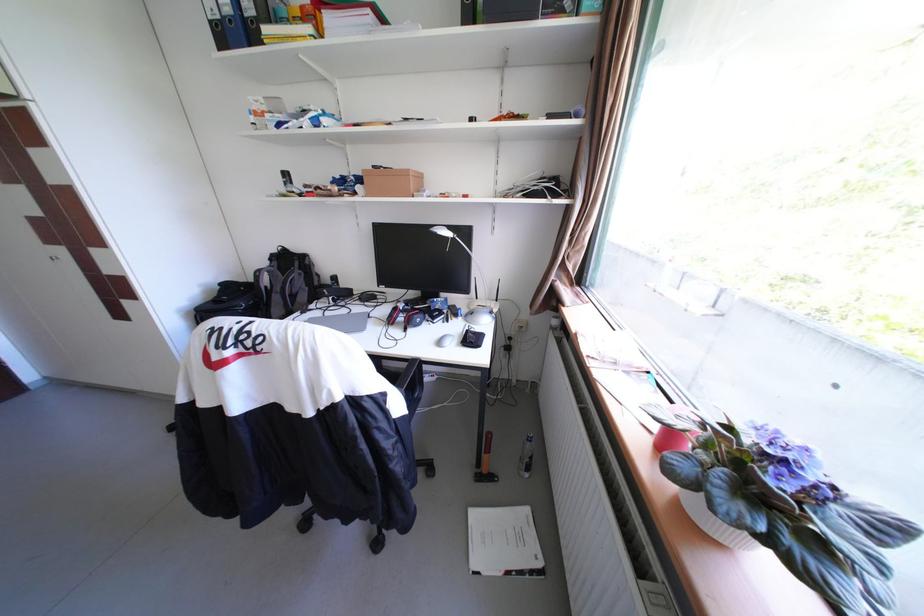
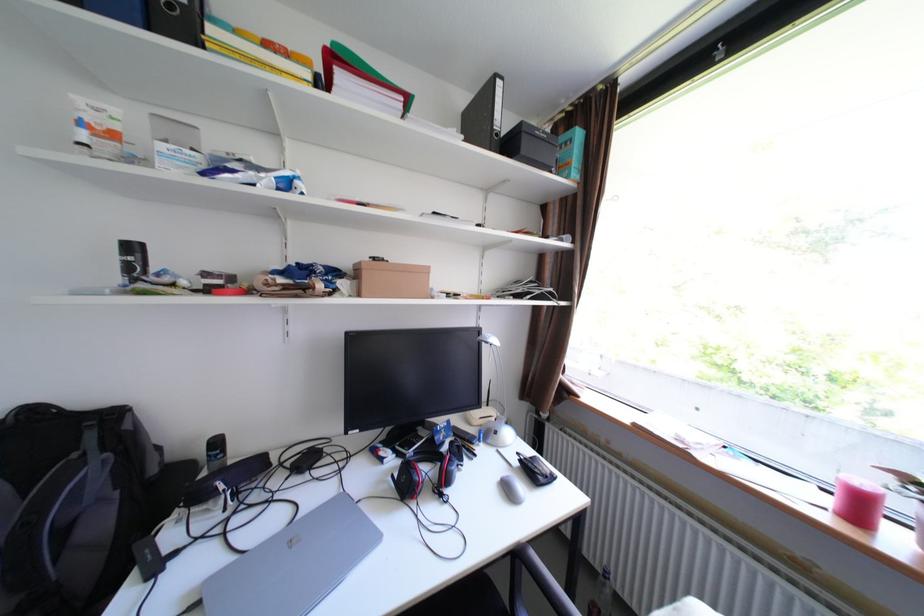
Where in the second image is the point corresponding to point (313, 297) from the first image?

(110, 524)